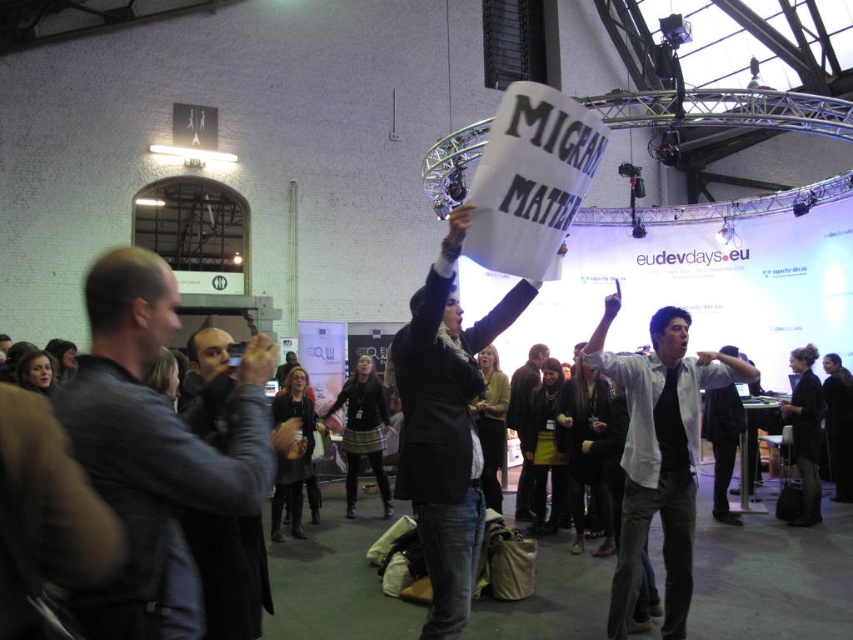
Question: Among these objects, which one is farthest from the camera?

Choices:
 (A) black matte jacket at center
 (B) dark brown leather jacket at center
 (C) leather jacket at left
 (D) dark gray leather jacket at left

Answer: (B)

Question: Among these points, which one is nearest to the camera?

Choices:
 (A) (228, 572)
 (B) (430, 481)
 (C) (152, 257)

Answer: (C)

Question: Is leather jacket at left bigger than white shirt at center?

Choices:
 (A) yes
 (B) no

Answer: (B)

Question: Is leather jacket at left to the left of dark brown leather jacket at center from the viewer's perspective?

Choices:
 (A) yes
 (B) no

Answer: (A)

Question: Can you confirm if leather jacket at left is positioned to the right of dark gray leather jacket at left?

Choices:
 (A) yes
 (B) no

Answer: (A)

Question: Among these objects, which one is nearest to the camera?

Choices:
 (A) dark brown leather jacket at center
 (B) dark gray leather jacket at left

Answer: (B)